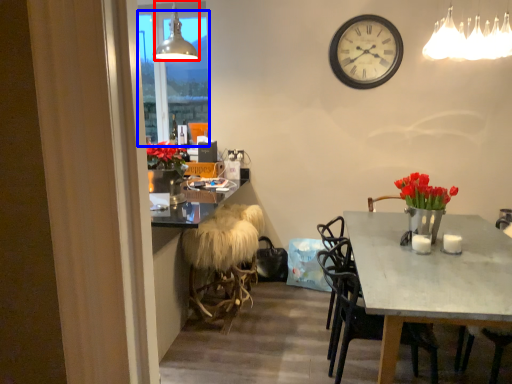
Question: Which object is closer to the camera taking this photo, lamp (highlighted by a red box) or window screen (highlighted by a blue box)?

Choices:
 (A) lamp
 (B) window screen

Answer: (A)